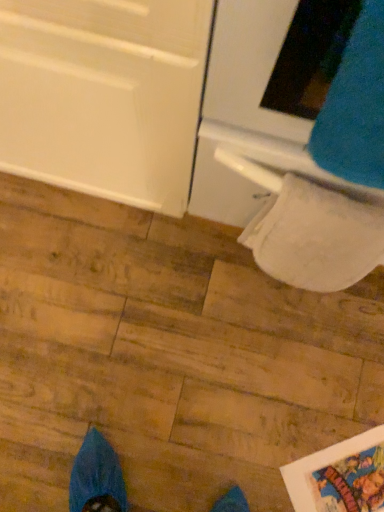
Question: Is white textured toilet paper at lower right thinner than blue fuzzy sweat pants at upper right?

Choices:
 (A) no
 (B) yes

Answer: (A)

Question: From the image's perspective, is white textured toilet paper at lower right under blue fuzzy sweat pants at upper right?

Choices:
 (A) no
 (B) yes

Answer: (B)

Question: Is the surface of white textured toilet paper at lower right in direct contact with blue fuzzy sweat pants at upper right?

Choices:
 (A) no
 (B) yes

Answer: (A)

Question: Can you confirm if white textured toilet paper at lower right is taller than blue fuzzy sweat pants at upper right?

Choices:
 (A) yes
 (B) no

Answer: (B)

Question: Can you confirm if white textured toilet paper at lower right is shorter than blue fuzzy sweat pants at upper right?

Choices:
 (A) no
 (B) yes

Answer: (B)

Question: From a real-world perspective, relative to blue fuzzy sweat pants at upper right, is white glossy oven at upper right vertically above or below?

Choices:
 (A) below
 (B) above

Answer: (A)

Question: Considering the positions of white glossy oven at upper right and blue fuzzy sweat pants at upper right in the image, is white glossy oven at upper right taller or shorter than blue fuzzy sweat pants at upper right?

Choices:
 (A) tall
 (B) short

Answer: (A)

Question: Is white glossy oven at upper right wider or thinner than blue fuzzy sweat pants at upper right?

Choices:
 (A) thin
 (B) wide

Answer: (B)

Question: Based on their positions, is white glossy oven at upper right located to the left or right of blue fuzzy sweat pants at upper right?

Choices:
 (A) right
 (B) left

Answer: (A)

Question: Considering the positions of point [x=342, y=197] and point [x=336, y=175], is point [x=342, y=197] closer or farther from the camera than point [x=336, y=175]?

Choices:
 (A) farther
 (B) closer

Answer: (A)

Question: Would you say white textured toilet paper at lower right is inside or outside blue fuzzy sweat pants at upper right?

Choices:
 (A) outside
 (B) inside

Answer: (A)

Question: Visually, is white textured toilet paper at lower right positioned to the left or to the right of blue fuzzy sweat pants at upper right?

Choices:
 (A) left
 (B) right

Answer: (A)

Question: From a real-world perspective, is white textured toilet paper at lower right physically located above or below blue fuzzy sweat pants at upper right?

Choices:
 (A) below
 (B) above

Answer: (A)

Question: From the image's perspective, is blue fuzzy sweat pants at upper right above or below white textured toilet paper at lower right?

Choices:
 (A) above
 (B) below

Answer: (A)

Question: Considering the relative positions of blue fuzzy sweat pants at upper right and white textured toilet paper at lower right in the image provided, is blue fuzzy sweat pants at upper right to the left or to the right of white textured toilet paper at lower right?

Choices:
 (A) right
 (B) left

Answer: (A)